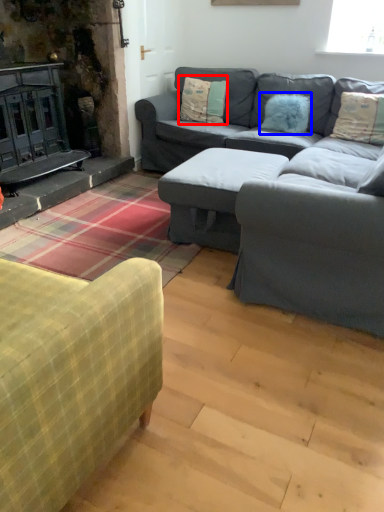
Question: Which point is closer to the camera, pillow (highlighted by a red box) or pillow (highlighted by a blue box)?

Choices:
 (A) pillow
 (B) pillow

Answer: (B)